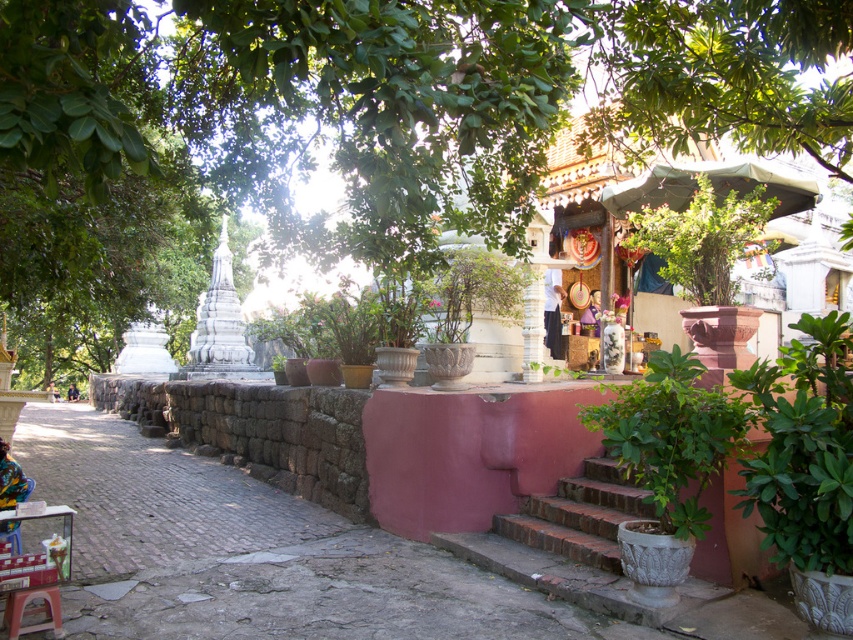
You are standing at the entrance of the small structure on the right side of the platform in the temple scene. Looking towards the upper center of the image, you notice a point marked at coordinates (x=358, y=122). What object is located at this point?

The point at coordinates (x=358, y=122) corresponds to the green leafy tree at upper center.

You are a drone operator tasked with capturing aerial footage of the temple area. The green leafy tree at upper center is located at coordinates 0.191, 0.421. If you want to frame the tree in the center of your shot, which direction should you adjust your camera? Please provide your answer in terms of cardinal directions like north, south, east, or west.

The green leafy tree at upper center is already positioned at the upper center of the scene, so adjusting the camera to center it would require moving slightly north to align with the tree at coordinates (358, 122).

You are a visitor at the temple and want to take a photo of the green leafy tree at upper center and the brick stairs at center in the same frame. Based on their distance, will you be able to capture both in a single photo without moving the camera?

The green leafy tree at upper center and brick stairs at center are 13.50 feet apart. Since the distance between them is 13.50 feet, it depends on your camera lens. A standard lens might require stepping back, but a wide angle could include both.